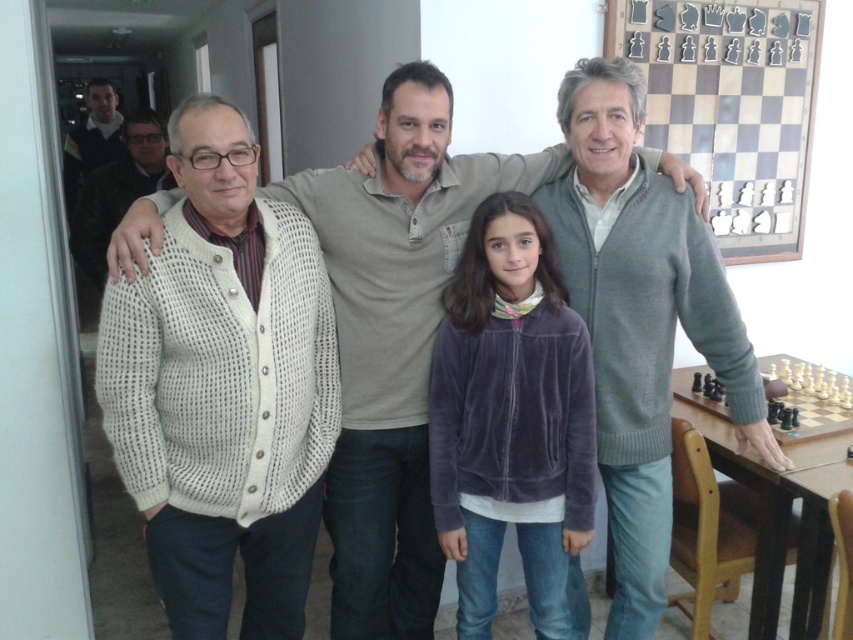
You are a photographer standing at the camera position. You want to hand a white knitted cardigan at left to someone in the group. Can you reach it without moving from your current position?

The white knitted cardigan at left and camera are 6.07 feet apart, so the photographer cannot reach the white knitted cardigan at left without moving since the distance is greater than an average person arm length.

Based on the scene description, which clothing item is wider between the white knitted cardigan at left and the gray knit sweater at right?

The white knitted cardigan at left is wider than the gray knit sweater at right.

You are organizing a clothing donation drive and need to determine which item takes up more space in the donation box. Based on the image, which of the two items, the white knitted cardigan at left or the white knitted sweater at left, is larger in size?

The white knitted cardigan at left is larger in size than the white knitted sweater at left, so it takes up more space in the donation box.